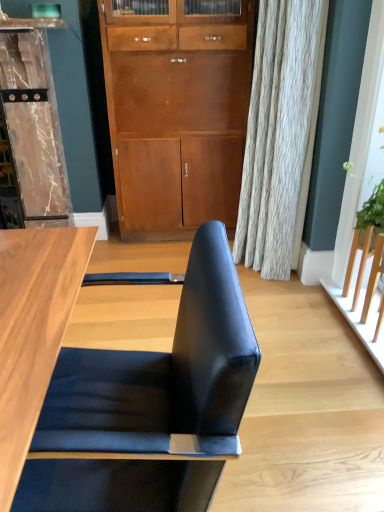
Question: Can you confirm if black leather chair at center is shorter than marble/textured dresser at left?

Choices:
 (A) yes
 (B) no

Answer: (A)

Question: From the image's perspective, is black leather chair at center under marble/textured dresser at left?

Choices:
 (A) yes
 (B) no

Answer: (A)

Question: Can you confirm if black leather chair at center is positioned to the right of marble/textured dresser at left?

Choices:
 (A) yes
 (B) no

Answer: (A)

Question: Does black leather chair at center have a greater width compared to marble/textured dresser at left?

Choices:
 (A) no
 (B) yes

Answer: (B)

Question: Would you say black leather chair at center contains marble/textured dresser at left?

Choices:
 (A) no
 (B) yes

Answer: (A)

Question: Is black leather chair at center inside or outside of marble/textured dresser at left?

Choices:
 (A) outside
 (B) inside

Answer: (A)

Question: Is point (125, 452) closer or farther from the camera than point (49, 178)?

Choices:
 (A) farther
 (B) closer

Answer: (B)

Question: Considering the positions of black leather chair at center and marble/textured dresser at left in the image, is black leather chair at center taller or shorter than marble/textured dresser at left?

Choices:
 (A) tall
 (B) short

Answer: (B)

Question: Would you say black leather chair at center is to the left or to the right of marble/textured dresser at left in the picture?

Choices:
 (A) right
 (B) left

Answer: (A)

Question: Considering the positions of black leather chair at center and matte wood cabinet at center in the image, is black leather chair at center taller or shorter than matte wood cabinet at center?

Choices:
 (A) short
 (B) tall

Answer: (A)

Question: Which is correct: black leather chair at center is inside matte wood cabinet at center, or outside of it?

Choices:
 (A) outside
 (B) inside

Answer: (A)

Question: Looking at their shapes, would you say black leather chair at center is wider or thinner than matte wood cabinet at center?

Choices:
 (A) wide
 (B) thin

Answer: (A)

Question: Is point (81, 371) positioned closer to the camera than point (187, 134)?

Choices:
 (A) farther
 (B) closer

Answer: (B)

Question: Considering the relative positions of marble/textured dresser at left and matte wood cabinet at center in the image provided, is marble/textured dresser at left to the left or to the right of matte wood cabinet at center?

Choices:
 (A) left
 (B) right

Answer: (A)

Question: Does point (44, 19) appear closer or farther from the camera than point (162, 193)?

Choices:
 (A) farther
 (B) closer

Answer: (B)